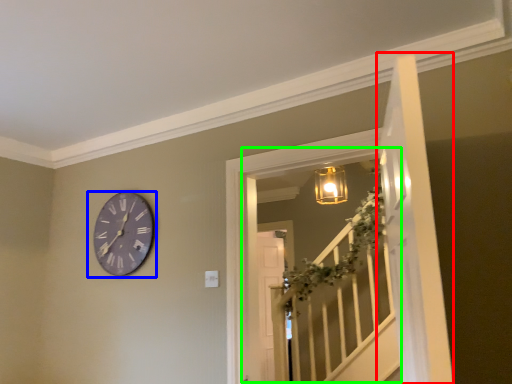
Question: Which is nearer to the door (highlighted by a red box)? wall clock (highlighted by a blue box) or window (highlighted by a green box).

Choices:
 (A) wall clock
 (B) window

Answer: (A)